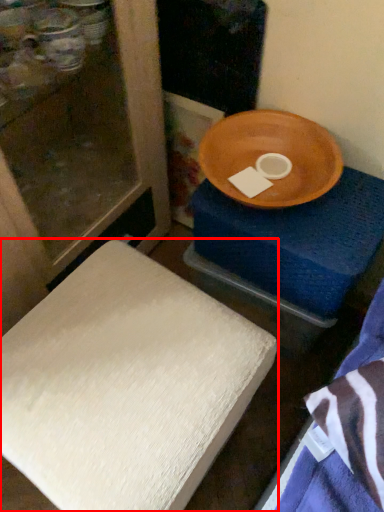
Question: From the image's perspective, what is the correct spatial relationship of furniture (annotated by the red box) in relation to changing table?

Choices:
 (A) above
 (B) below

Answer: (B)